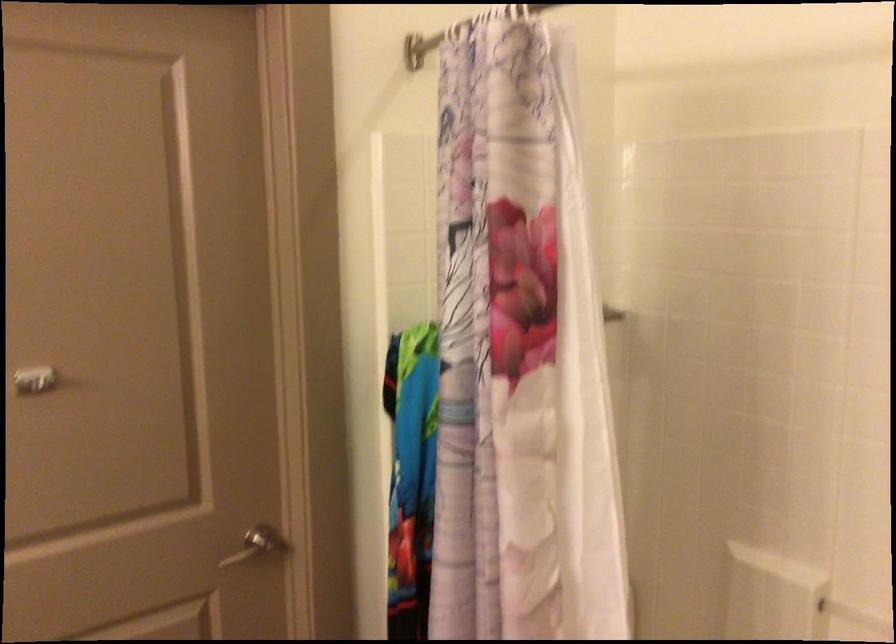
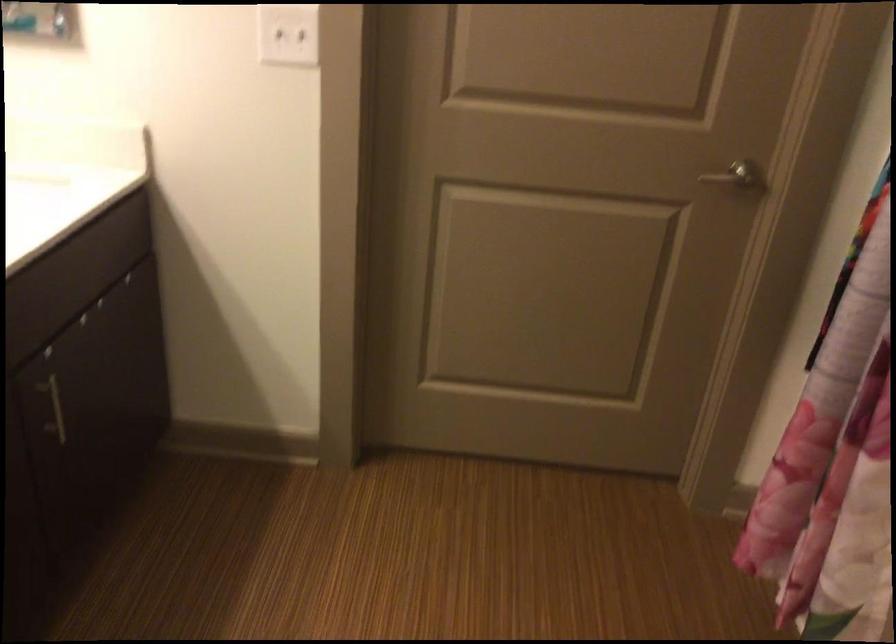
Based on the continuous images, in which direction is the camera rotating?

The camera rotated toward left-down.